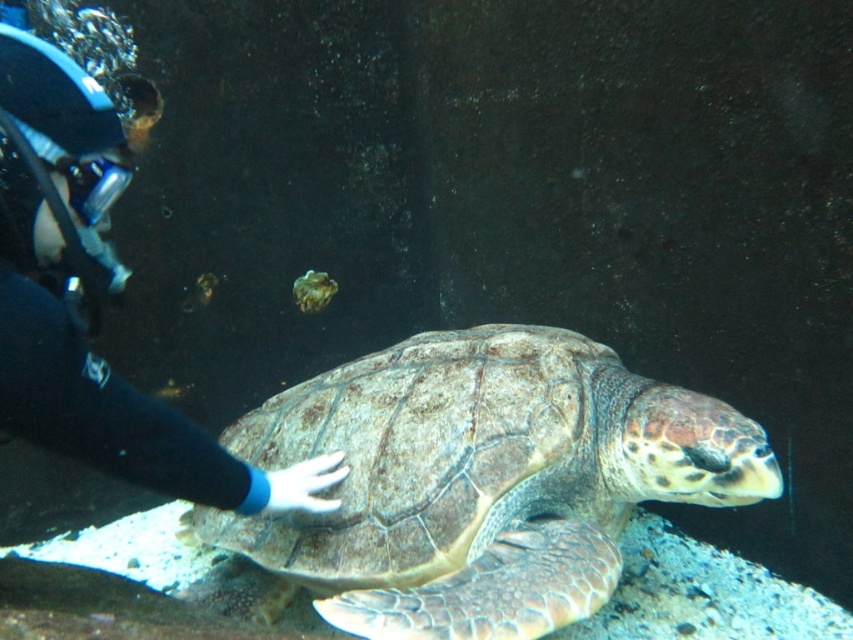
Question: Does leathery brown turtle at center have a lesser width compared to black rubber glove at lower left?

Choices:
 (A) yes
 (B) no

Answer: (B)

Question: Can you confirm if leathery brown turtle at center is positioned to the right of black rubber glove at lower left?

Choices:
 (A) no
 (B) yes

Answer: (B)

Question: Can you confirm if leathery brown turtle at center is positioned to the right of black rubber glove at lower left?

Choices:
 (A) yes
 (B) no

Answer: (A)